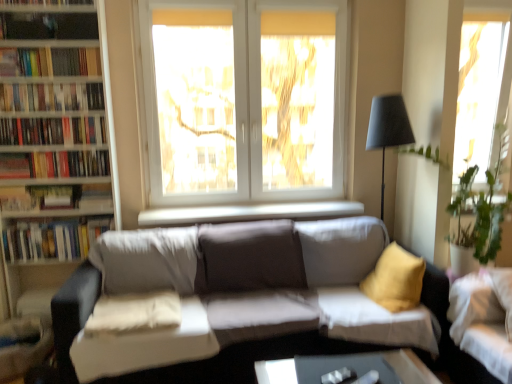
At what (x,y) coordinates should I click in order to perform the action: click on vacant space underneath white glass window at center, arranged as the 2th window when viewed from the right (from a real-world perspective). Please return your answer as a coordinate pair (x, y). The image size is (512, 384). Looking at the image, I should click on pos(248,203).